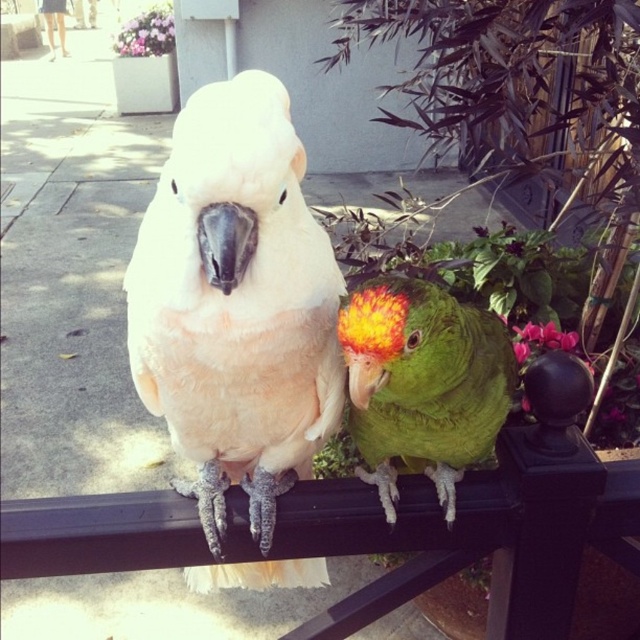
Does point (278, 177) come behind point (408, 387)?

No, it is in front of (408, 387).

Which is behind, point (321, 269) or point (483, 353)?

The point (483, 353) is more distant.

Locate an element on the screen. white feathered parrot at center is located at coordinates (236, 301).